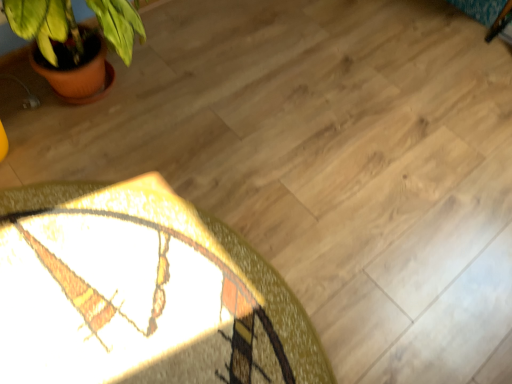
The width and height of the screenshot is (512, 384). Identify the location of vacant space situated above shiny glass table at center (from a real-world perspective). (135, 291).